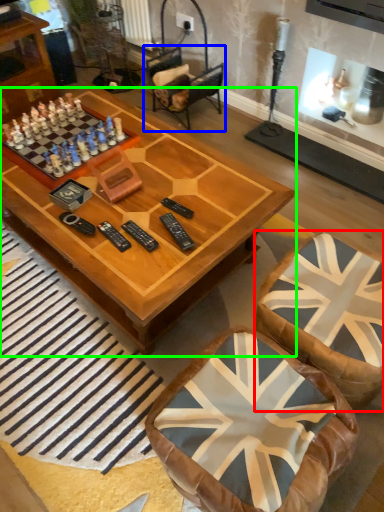
Question: Estimate the real-world distances between objects in this image. Which object is closer to swivel chair (highlighted by a red box), armchair (highlighted by a blue box) or coffee table (highlighted by a green box)?

Choices:
 (A) armchair
 (B) coffee table

Answer: (B)